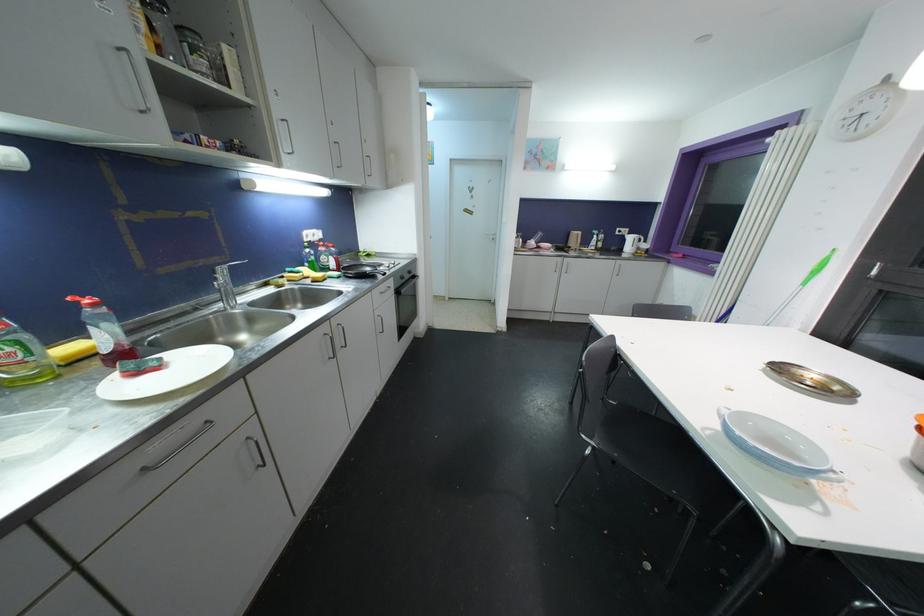
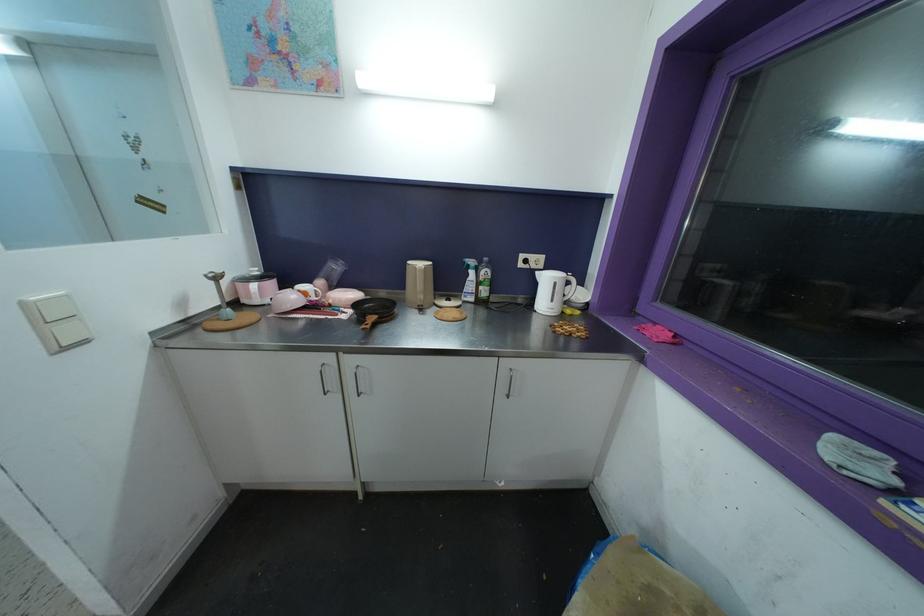
In a continuous first-person perspective shot, in which direction is the camera moving?

The cameraman walked toward right, forward.